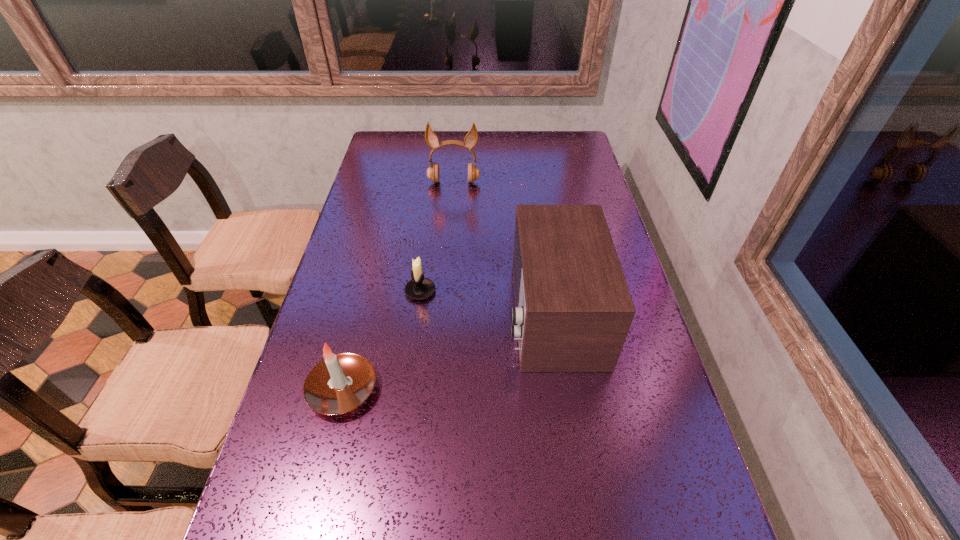
Find the location of a particular element. free space between the shortest object and the farthest object is located at coordinates (437, 237).

The image size is (960, 540). Find the location of `empty space between the rightmost object and the shortest object`. empty space between the rightmost object and the shortest object is located at coordinates (487, 302).

At what (x,y) coordinates should I click in order to perform the action: click on empty location between the radio receiver and the leftmost object. Please return your answer as a coordinate pair (x, y). Looking at the image, I should click on (447, 351).

In order to click on free space that is in between the candle holder and the earphone in this screenshot , I will do click(x=437, y=237).

The width and height of the screenshot is (960, 540). I want to click on object that is the second nearest to the earphone, so click(x=419, y=288).

Identify which object is the closest to the shortest object. Please provide its 2D coordinates. Your answer should be formatted as a tuple, i.e. [(x, y)], where the tuple contains the x and y coordinates of a point satisfying the conditions above.

[(339, 383)]